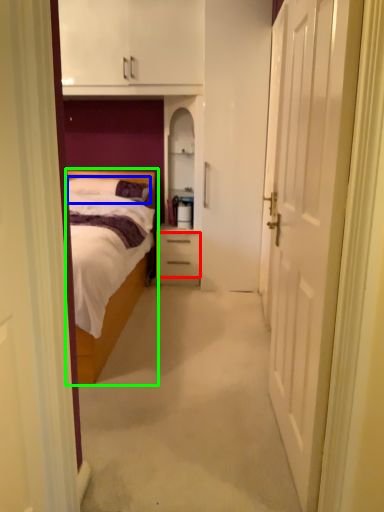
Question: Estimate the real-world distances between objects in this image. Which object is closer to drawer (highlighted by a red box), pillow (highlighted by a blue box) or bed (highlighted by a green box)?

Choices:
 (A) pillow
 (B) bed

Answer: (A)